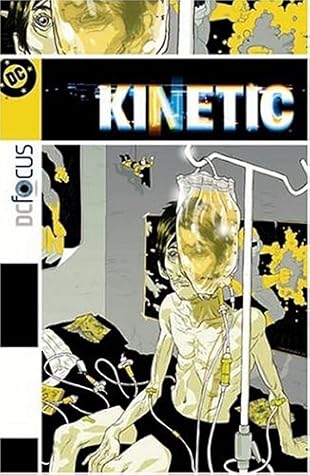
You are a GUI agent. You are given a task and a screenshot of the screen. Output one action in this format:
    pyautogui.click(x=<x>, y=<y>)
    Task: Click on the yellow book lying on bed
    The image size is (310, 475).
    Given the screenshot: What is the action you would take?
    pyautogui.click(x=87, y=323)